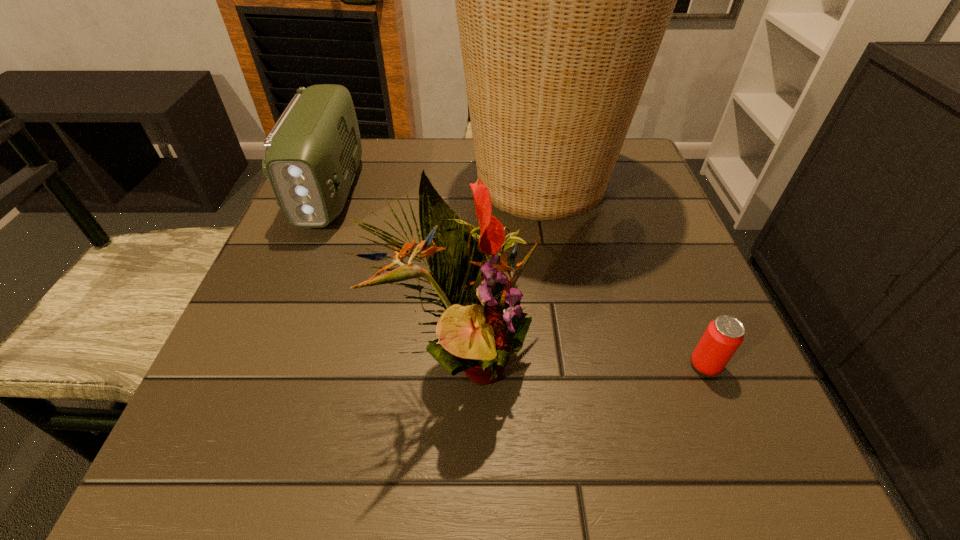
Image resolution: width=960 pixels, height=540 pixels. Find the location of `vacant space at the right edge of the desktop`. vacant space at the right edge of the desktop is located at coordinates (652, 357).

Locate an element on the screen. The height and width of the screenshot is (540, 960). free region at the far right corner of the desktop is located at coordinates (626, 150).

The width and height of the screenshot is (960, 540). I want to click on free space between the beer can and the second tallest object, so click(x=584, y=361).

In order to click on blank region between the shortest object and the bouquet in this screenshot , I will do `click(584, 361)`.

You are a GUI agent. You are given a task and a screenshot of the screen. Output one action in this format:
    pyautogui.click(x=<x>, y=<y>)
    Task: Click on the free point between the second shortest object and the tallest object
    The image size is (960, 540).
    Given the screenshot: What is the action you would take?
    pyautogui.click(x=436, y=186)

Identify the location of empty space that is in between the beer can and the tallest object. (623, 273).

What are the coordinates of `object that stands as the third closest to the second tallest object` in the screenshot? It's located at (723, 336).

Identify which object is the third closest to the beer can. Please provide its 2D coordinates. Your answer should be formatted as a tuple, i.e. [(x, y)], where the tuple contains the x and y coordinates of a point satisfying the conditions above.

[(313, 151)]

Identify the location of blank area in the image that satisfies the following two spatial constraints: 1. on the front-facing side of the third shortest object; 2. on the back side of the shortest object. The width and height of the screenshot is (960, 540). (462, 364).

Locate an element on the screen. The image size is (960, 540). vacant space that satisfies the following two spatial constraints: 1. on the front-facing side of the shortest object; 2. on the right side of the second shortest object is located at coordinates (259, 364).